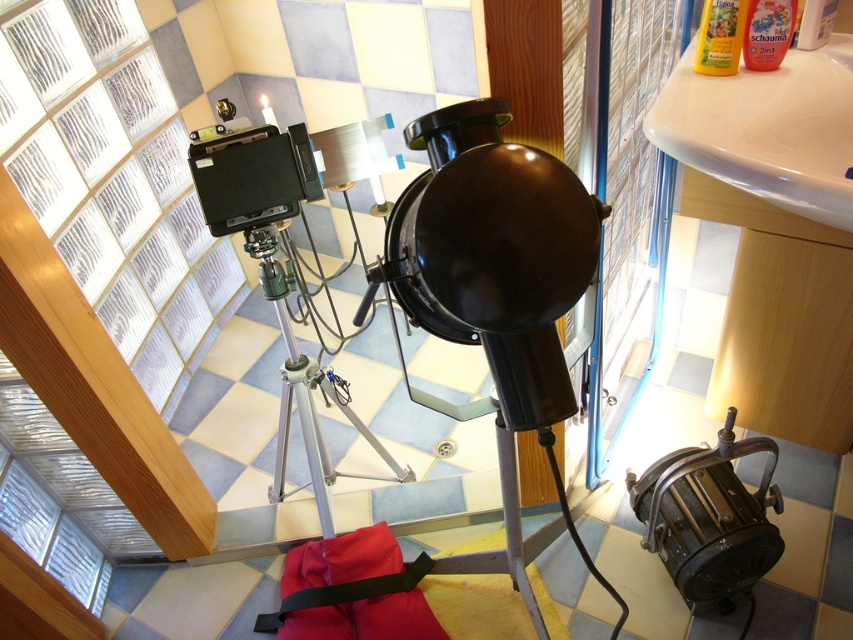
You are setting up a photo shoot in the bathroom shown. You need to place a metallic brass lamp at lower right and a matte red bag at lower center. According to the scene, which object is positioned to the right of the other?

The metallic brass lamp at lower right is to the right of the matte red bag at lower center.

You are a photographer setting up equipment in a bathroom with checkered tiles. You need to place a matte red bag at lower center. Where should you place it?

The matte red bag at lower center should be placed at point coordinates of (352, 589).